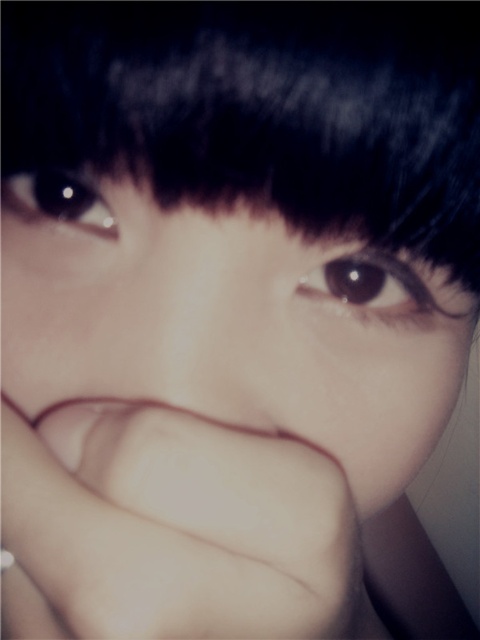
You are a photographer adjusting the focus on a camera. You need to ensure that both the black matte hair at upper center and the brown glossy eye at center are in focus. Given their sizes, which object should you prioritize focusing on first to ensure clarity?

The black matte hair at upper center is larger in size than the brown glossy eye at center, so you should prioritize focusing on the black matte hair at upper center first because larger objects often require more precise focus adjustments to maintain clarity across their entire area.

You are a photographer analyzing this portrait. You need to determine if the black matte hair at upper center is wider than the brown glossy eye at center. Based on the scene, what can you conclude?

The black matte hair at upper center is wider than the brown glossy eye at center because the description states that the black matte hair at upper center surpasses the brown glossy eye at center in width.